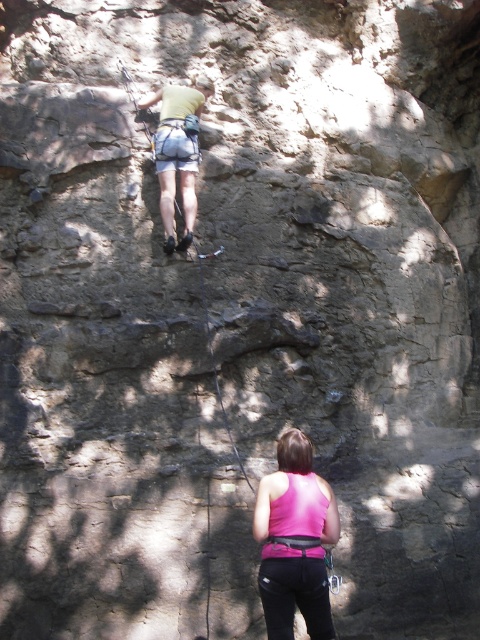
You are a rock climbing instructor assessing the gear of two climbers. You see the pink fabric tank top at lower center and the matte yellow shirt at upper center. Which climber is wearing a narrower top?

The pink fabric tank top at lower center is narrower than the matte yellow shirt at upper center.

You are standing at the base of the rock face and want to retrieve your climbing gear from the matte yellow shirt at upper center. Can you reach it without climbing the rock?

The matte yellow shirt at upper center is 9.55 meters away from the viewer, so you cannot reach it without climbing the rock.

You are a drone operator trying to capture the climber wearing the matte yellow shirt at upper center. The drone is currently at point A, which is at coordinates 0.2, 0.3. To get a clear shot, you need to move the drone to a position that is 0.05 units higher and 0.02 units to the right of the climber. What are the new coordinates where you should position the drone?

The new coordinates would be 0.259 units in the x direction and 0.421 units in the y direction.